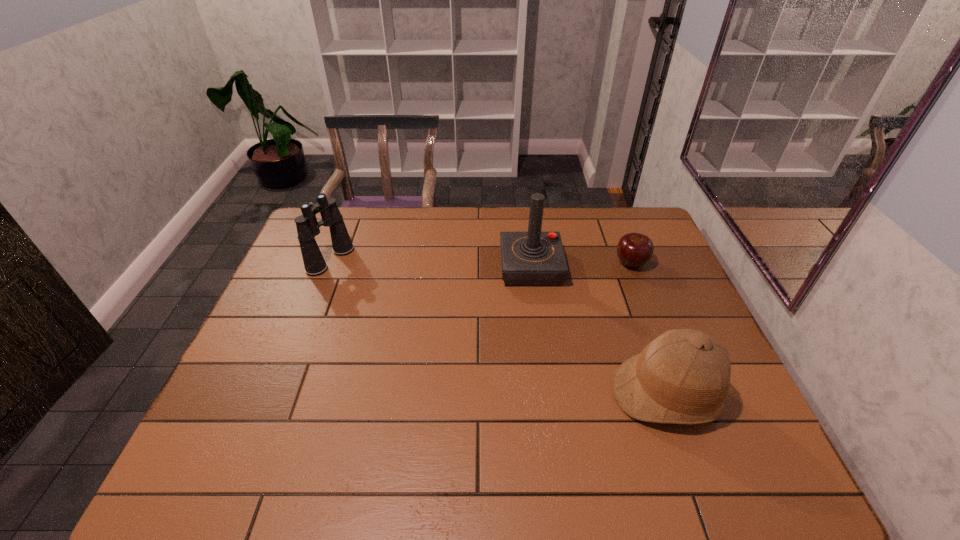
Where is `the tallest object`? the tallest object is located at coordinates (534, 258).

You are a GUI agent. You are given a task and a screenshot of the screen. Output one action in this format:
    pyautogui.click(x=<x>, y=<y>)
    Task: Click on the joystick
    The image size is (960, 540).
    Given the screenshot: What is the action you would take?
    pyautogui.click(x=534, y=258)

I want to click on the leftmost object, so click(x=307, y=226).

Find the location of `hat`. hat is located at coordinates (683, 376).

Image resolution: width=960 pixels, height=540 pixels. I want to click on apple, so click(x=634, y=250).

This screenshot has height=540, width=960. I want to click on free space located 0.330m on the rectangular base of the second object from left to right, so click(397, 268).

At what (x,y) coordinates should I click in order to perform the action: click on free region located on the rectangular base of the second object from left to right. Please return your answer as a coordinate pair (x, y). The image size is (960, 540). Looking at the image, I should click on (469, 268).

Identify the location of vacant region located on the rectangular base of the second object from left to right. (397, 268).

This screenshot has height=540, width=960. What are the coordinates of `vacant space located on the front of the binoculars` in the screenshot? It's located at (316, 297).

Locate an element on the screen. blank space located on the front of the shortest object is located at coordinates (661, 341).